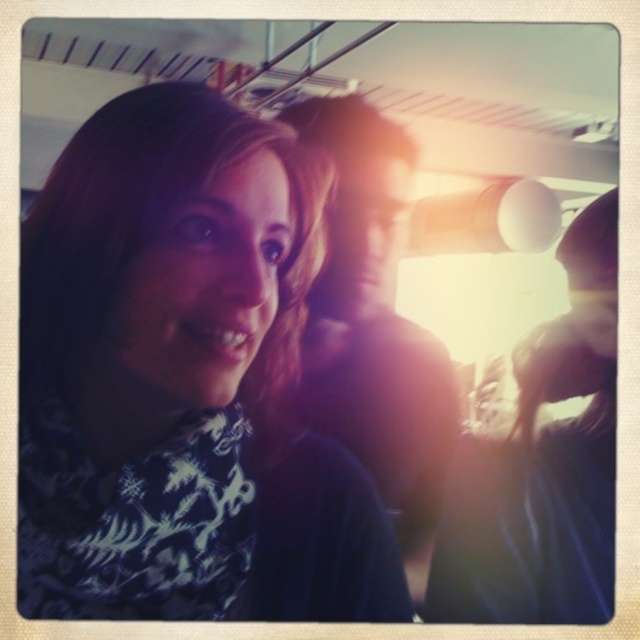
You are at a social event and notice two items in the photo. One is the matte black scarf at left and the other is the smooth dark hair at center. Which item is located to the left of the other?

The matte black scarf at left is positioned on the left side of smooth dark hair at center.

You are at a social event and see a person wearing a dark top with a patterned design. There is also a matte black scarf at left. Where is the matte black scarf located in relation to the person?

The matte black scarf at left is located at point [182,380].

You are at a social event and want to take a photo of the matte black scarf at left and the smooth dark hair at center. Which object should you focus on to ensure both are in frame without zooming?

You should focus on the smooth dark hair at center because it occupies more space than the matte black scarf at left, so centering it will help keep both in frame.